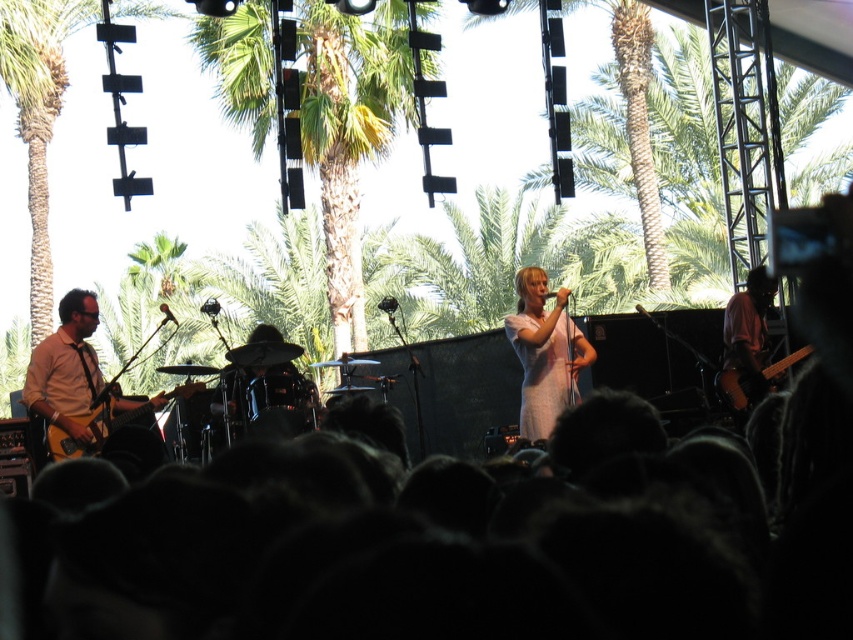
You are a photographer at the concert and want to capture a photo where the black hair at lower center is visible without being blocked by the matte brown guitar at left. Based on their positions, is this possible?

The black hair at lower center is positioned under the matte brown guitar at left, so it will be blocked by the guitar and not visible in the photo.

You are standing at the point marked as point (x=247, y=42) on the stage. The drummer is seated behind the drum kit in the center of the stage. Can you see the drummer from your current position?

The point (x=247, y=42) is 15.21 meters away from the camera, so you are far away from the drummer who is in the center of the stage. Therefore, you might not be able to see the drummer clearly from that position.

Looking at this image, you are a photographer standing at the front of the stage. You want to take a photo that includes both the black hair at lower center and the matte brown guitar at left. Which object will appear larger in the photo?

The black hair at lower center will appear larger in the photo because it is closer to the viewer than the matte brown guitar at left.